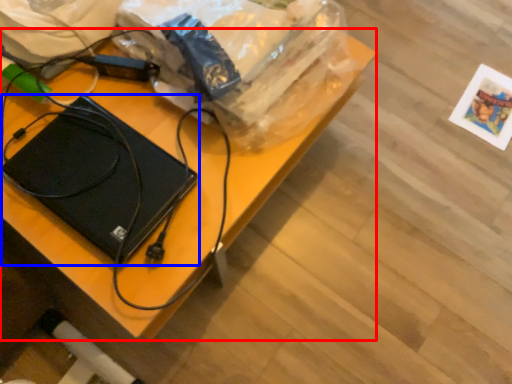
Question: Among these objects, which one is nearest to the camera, desk (highlighted by a red box) or laptop (highlighted by a blue box)?

Choices:
 (A) desk
 (B) laptop

Answer: (A)